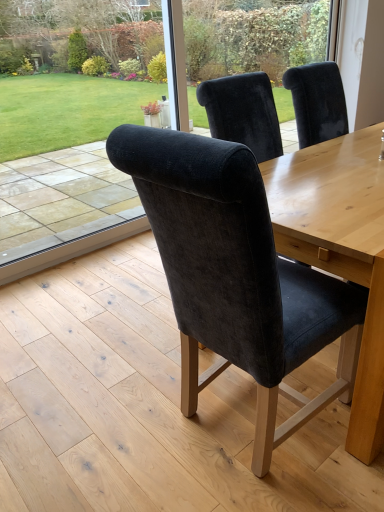
Question: Is velvet chair back at center in front of velvet dark blue chair at center?

Choices:
 (A) yes
 (B) no

Answer: (B)

Question: Is velvet chair back at center bigger than velvet dark blue chair at center?

Choices:
 (A) yes
 (B) no

Answer: (B)

Question: Is velvet chair back at center positioned with its back to velvet dark blue chair at center?

Choices:
 (A) yes
 (B) no

Answer: (B)

Question: Can you confirm if velvet chair back at center is positioned to the right of velvet dark blue chair at center?

Choices:
 (A) no
 (B) yes

Answer: (A)

Question: From the image's perspective, is velvet chair back at center located above velvet dark blue chair at center?

Choices:
 (A) yes
 (B) no

Answer: (A)

Question: Is velvet dark blue chair at center bigger or smaller than velvet chair back at center?

Choices:
 (A) big
 (B) small

Answer: (A)

Question: From a real-world perspective, relative to velvet chair back at center, is velvet dark blue chair at center vertically above or below?

Choices:
 (A) below
 (B) above

Answer: (A)

Question: In the image, is velvet dark blue chair at center positioned in front of or behind velvet chair back at center?

Choices:
 (A) behind
 (B) front

Answer: (B)

Question: From the image's perspective, is velvet dark blue chair at center above or below velvet chair back at center?

Choices:
 (A) below
 (B) above

Answer: (A)

Question: Considering the positions of velvet dark blue chair at center and transparent glass door at upper center in the image, is velvet dark blue chair at center taller or shorter than transparent glass door at upper center?

Choices:
 (A) tall
 (B) short

Answer: (A)

Question: Is velvet dark blue chair at center bigger or smaller than transparent glass door at upper center?

Choices:
 (A) big
 (B) small

Answer: (A)

Question: From the image's perspective, relative to transparent glass door at upper center, is velvet dark blue chair at center above or below?

Choices:
 (A) below
 (B) above

Answer: (A)

Question: From a real-world perspective, is velvet dark blue chair at center above or below transparent glass door at upper center?

Choices:
 (A) below
 (B) above

Answer: (A)

Question: Relative to transparent glass door at upper center, is velvet chair back at center in front or behind?

Choices:
 (A) behind
 (B) front

Answer: (B)

Question: Is velvet chair back at center bigger or smaller than transparent glass door at upper center?

Choices:
 (A) big
 (B) small

Answer: (A)